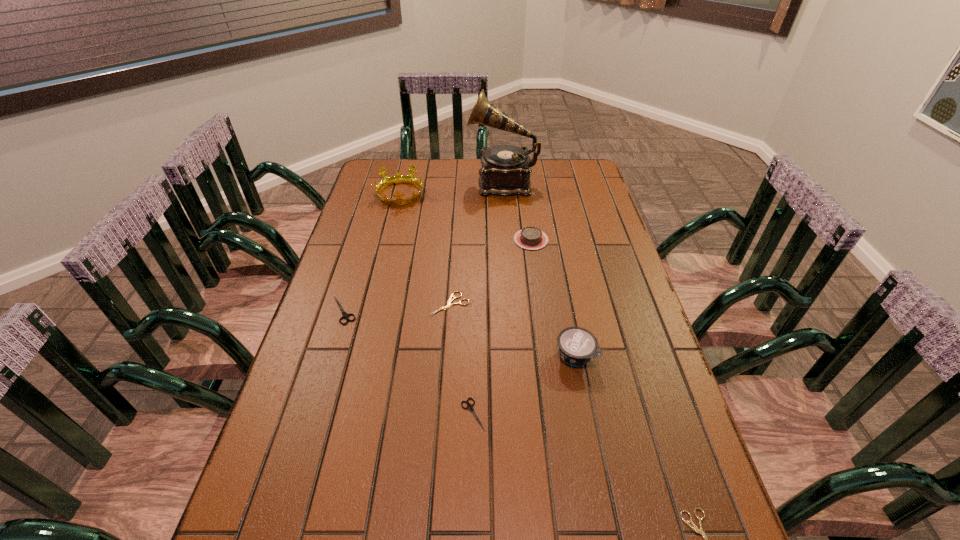
Locate which shears ranks third in proximity to the tallest object. Please provide its 2D coordinates. Your answer should be formatted as a tuple, i.e. [(x, y)], where the tuple contains the x and y coordinates of a point satisfying the conditions above.

[(469, 406)]

Where is `shears that can be found as the second closest to the farther beige shears`? The height and width of the screenshot is (540, 960). shears that can be found as the second closest to the farther beige shears is located at coordinates (469, 406).

Where is `free location that satisfies the following two spatial constraints: 1. on the horn of the yogurt; 2. on the right side of the tallest object`? free location that satisfies the following two spatial constraints: 1. on the horn of the yogurt; 2. on the right side of the tallest object is located at coordinates (515, 356).

Locate an element on the screen. The image size is (960, 540). vacant space that satisfies the following two spatial constraints: 1. on the back side of the fourth shortest object; 2. on the left side of the gold crown is located at coordinates (379, 194).

Locate an element on the screen. The height and width of the screenshot is (540, 960). vacant area that satisfies the following two spatial constraints: 1. on the horn of the phonograph record; 2. on the front side of the farther black shears is located at coordinates (512, 310).